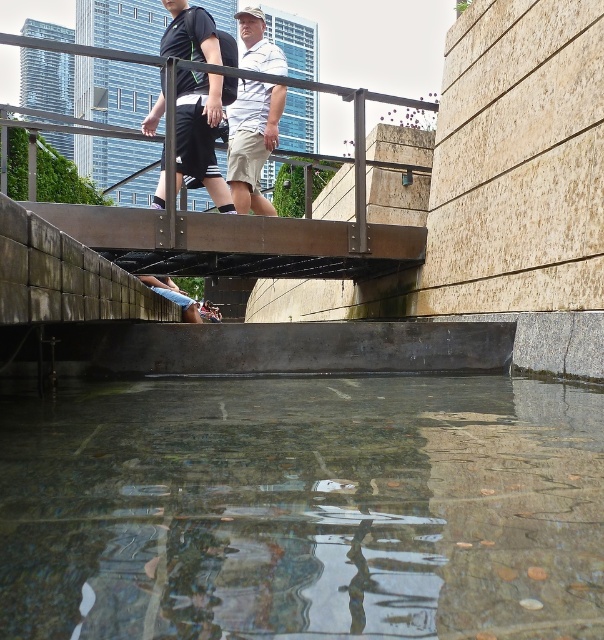
Who is higher up, black matte shorts at center or white matte shirt at center?

white matte shirt at center

Is black matte shorts at center to the right of white matte shirt at center from the viewer's perspective?

No, black matte shorts at center is not to the right of white matte shirt at center.

This screenshot has height=640, width=604. Identify the location of black matte shorts at center. (199, 132).

Can you confirm if clear glass water at lower center is smaller than white matte shirt at center?

Yes.

Where is `clear glass water at lower center`? The image size is (604, 640). clear glass water at lower center is located at coordinates (303, 508).

Does point (190, 616) lie in front of point (223, 195)?

Yes, point (190, 616) is closer to viewer.

Find the location of a particular element. Image resolution: width=604 pixels, height=640 pixels. clear glass water at lower center is located at coordinates (303, 508).